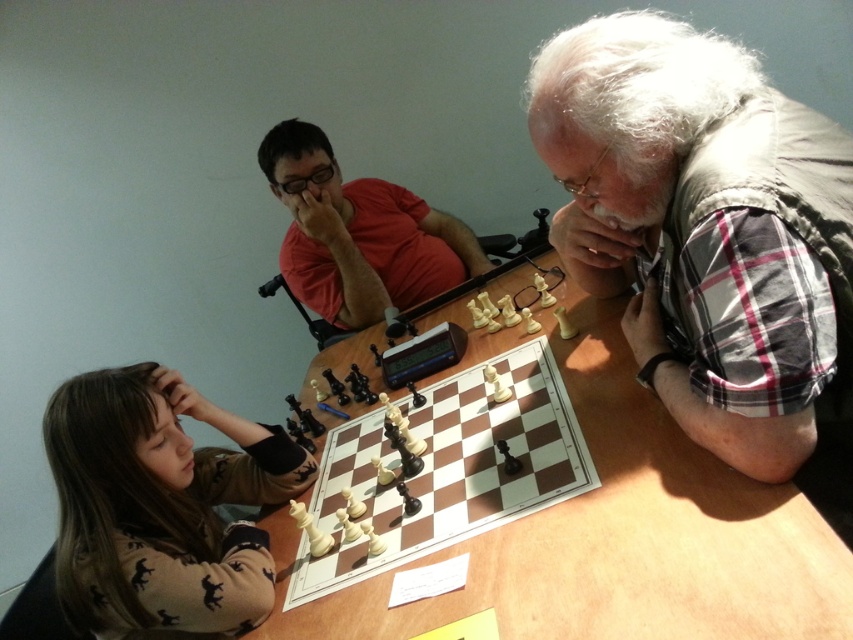
You are a delivery robot with a 10 inch wide package. You need to place it between the brown sweater at lower left and the wooden chessboard at center. Is there enough space?

The brown sweater at lower left is 9.96 inches away from the wooden chessboard at center. Since the package is 10 inches wide, there isn not enough space to place it between them.

Where is the gray vest at upper right located in the image?

The gray vest at upper right is located at point 0.353 on the x axis and 0.821 on the y axis.

You are a photographer standing in front of the chess scene. You want to take a photo that includes both the brown sweater at lower left and the wooden chessboard at center. Which object should you focus on first to ensure both are in clear view?

The brown sweater at lower left is further to the viewer than the wooden chessboard at center. To ensure both are in clear view, focus on the brown sweater at lower left first, as it is closer, and the depth of field will naturally include the wooden chessboard at center in the background.